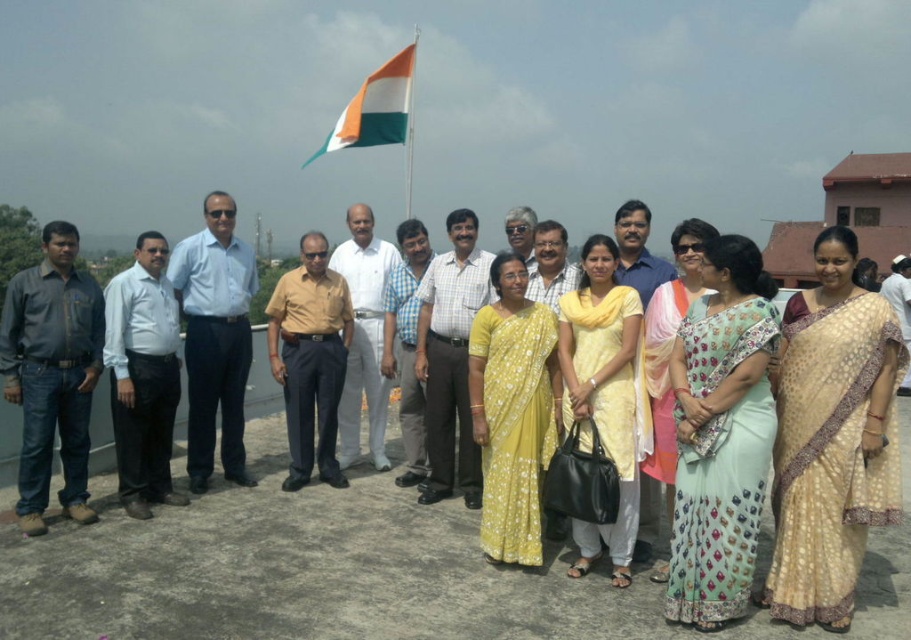
Is white shirt at center taller than yellow cotton shirt at center?

No, white shirt at center is not taller than yellow cotton shirt at center.

Based on the photo, can you confirm if white shirt at center is bigger than yellow cotton shirt at center?

Incorrect, white shirt at center is not larger than yellow cotton shirt at center.

Describe the element at coordinates (142, 376) in the screenshot. I see `white shirt at center` at that location.

Find the location of a particular element. The image size is (911, 640). white shirt at center is located at coordinates (142, 376).

Measure the distance from yellow cotton shirt at center to checkered fabric shirt at center.

3.91 feet

Is yellow cotton shirt at center smaller than checkered fabric shirt at center?

Correct, yellow cotton shirt at center occupies less space than checkered fabric shirt at center.

Is point (316, 248) positioned after point (464, 436)?

Yes, it is behind point (464, 436).

Locate an element on the screen. yellow cotton shirt at center is located at coordinates (310, 358).

Between beige silk saree at center and dark gray shirt at left, which one has less height?

dark gray shirt at left is shorter.

Who is positioned more to the left, beige silk saree at center or dark gray shirt at left?

dark gray shirt at left is more to the left.

Which is in front, point (783, 365) or point (65, 243)?

Point (783, 365)

This screenshot has height=640, width=911. In order to click on beige silk saree at center in this screenshot , I will do `click(831, 436)`.